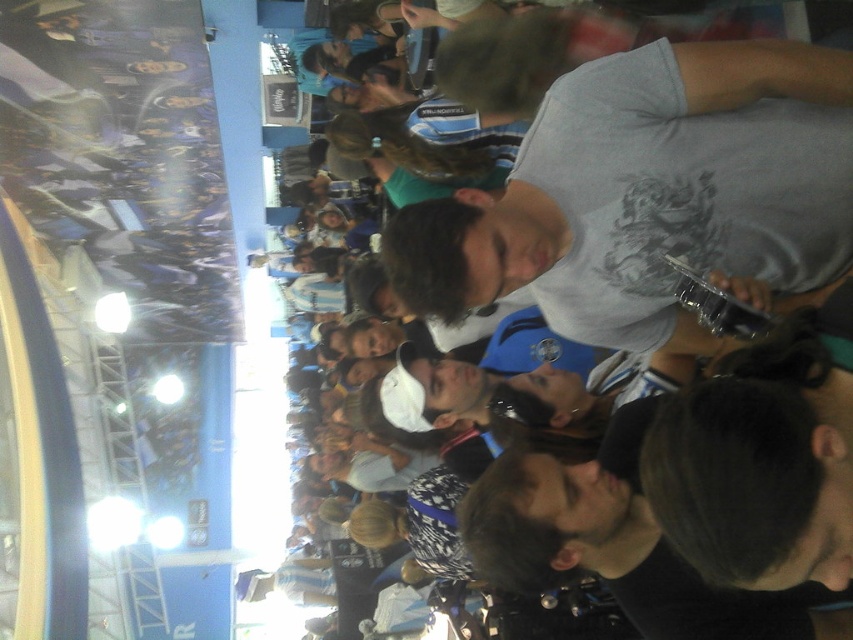
You are a photographer standing at the edge of the crowd, and you want to take a photo of both the white cotton shirt at center and the black matte shirt at center. The minimum distance your camera can focus clearly on two objects is 3 meters. Can you capture both shirts in focus without moving closer?

The white cotton shirt at center is 2.78 meters away from the black matte shirt at center. Since the distance between them is less than 3 meters, your camera can focus both shirts clearly without moving closer.

You are at a busy event and need to quickly identify which shirt is visible on top. There are two shirts at the center of the scene, a white cotton shirt at center and a black matte shirt at center. Which one is covering the other?

The white cotton shirt at center is positioned over black matte shirt at center, so it is covering the black matte shirt at center.